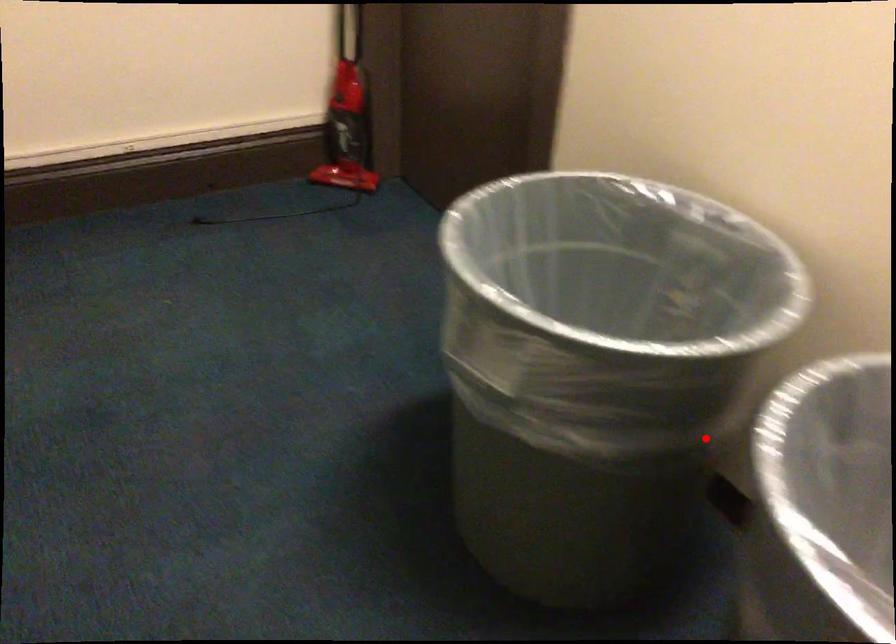
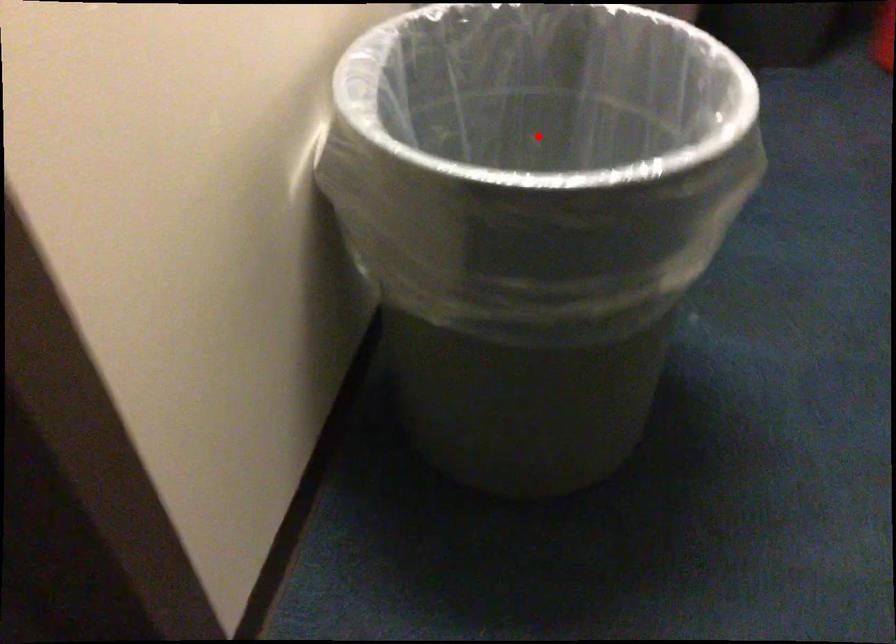
I am providing you with two images of the same scene from different viewpoints. A red point is marked on the first image and another point is marked on the second image. Is the red point in image1 aligned with the point shown in image2?

Yes